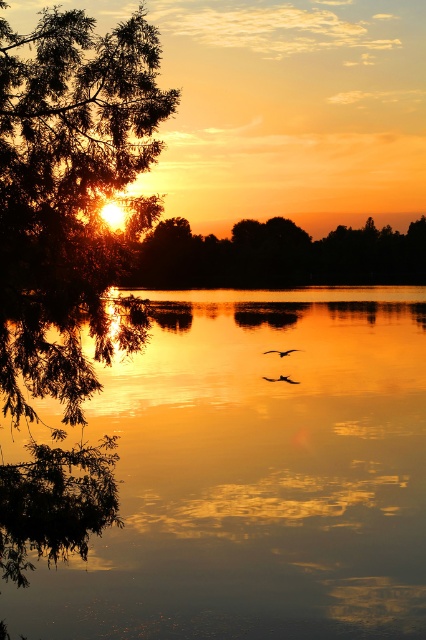
Question: Among these points, which one is nearest to the camera?

Choices:
 (A) (158, 584)
 (B) (282, 349)
 (C) (132, 124)

Answer: (C)

Question: Does glossy reflective water at center come in front of green leafy tree at left?

Choices:
 (A) no
 (B) yes

Answer: (A)

Question: Estimate the real-world distances between objects in this image. Which object is closer to the silhouette glossy bird at center?

Choices:
 (A) brown matte bird at center
 (B) glossy reflective water at center
 (C) green leafy tree at left

Answer: (A)

Question: Which object appears closest to the camera in this image?

Choices:
 (A) glossy reflective water at center
 (B) brown matte bird at center
 (C) green leafy tree at left
 (D) silhouette glossy bird at center

Answer: (C)

Question: Does green leafy tree at center lie behind brown matte bird at center?

Choices:
 (A) no
 (B) yes

Answer: (A)

Question: Does green leafy tree at left appear on the left side of green leafy tree at center?

Choices:
 (A) yes
 (B) no

Answer: (A)